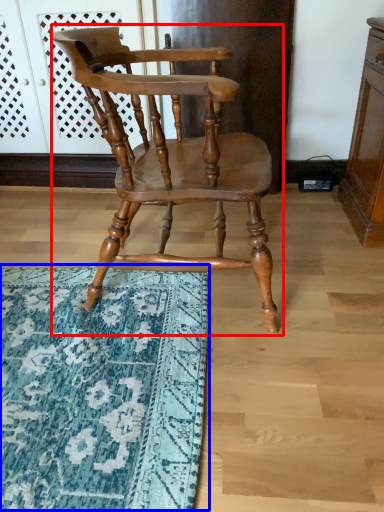
Question: Which of the following is the closest to the observer, chair (highlighted by a red box) or mat (highlighted by a blue box)?

Choices:
 (A) chair
 (B) mat

Answer: (A)